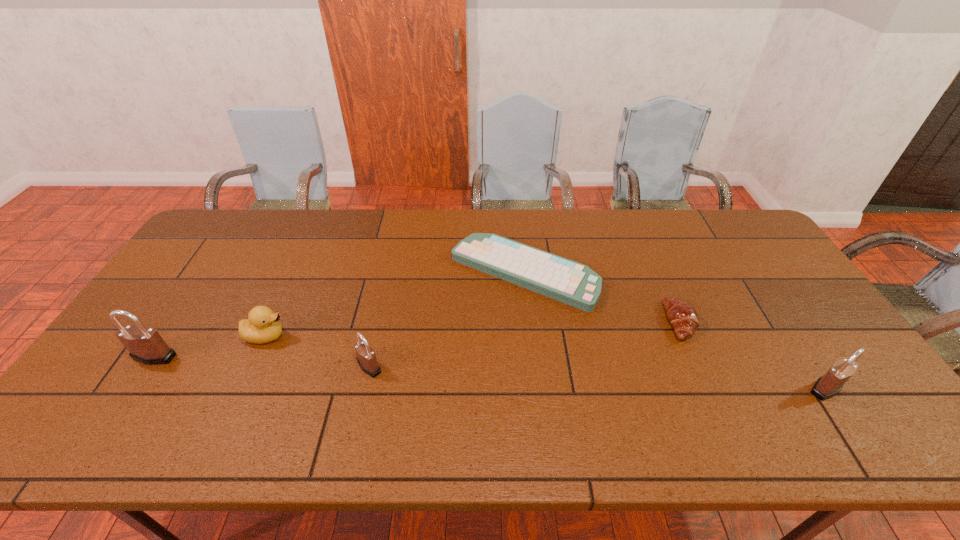
The height and width of the screenshot is (540, 960). What are the coordinates of `the third shortest object` in the screenshot? It's located at (262, 326).

Where is `free spot located on the back of the leftmost padlock`? Image resolution: width=960 pixels, height=540 pixels. free spot located on the back of the leftmost padlock is located at coordinates (216, 264).

You are a GUI agent. You are given a task and a screenshot of the screen. Output one action in this format:
    pyautogui.click(x=<x>, y=<y>)
    Task: Click on the free spot located 0.380m on the back of the second padlock from right to left
    Image resolution: width=960 pixels, height=540 pixels.
    Given the screenshot: What is the action you would take?
    pyautogui.click(x=393, y=261)

Locate an element on the screen. vacant area located on the left of the rightmost padlock is located at coordinates (713, 388).

The height and width of the screenshot is (540, 960). Find the location of `vacant area located 0.090m on the front of the computer keyboard`. vacant area located 0.090m on the front of the computer keyboard is located at coordinates (531, 336).

I want to click on free location located 0.120m on the right of the fifth object from left to right, so click(x=737, y=321).

What are the coordinates of `free spot located 0.260m on the face of the fourth tallest object` in the screenshot? It's located at (383, 336).

Locate an element on the screen. object positioned at the far edge is located at coordinates (567, 281).

Find the location of a particular element. The height and width of the screenshot is (540, 960). object at the left edge is located at coordinates (145, 344).

At what (x,y) coordinates should I click in order to perform the action: click on object located in the right edge section of the desktop. Please return your answer as a coordinate pair (x, y). This screenshot has height=540, width=960. Looking at the image, I should click on (829, 385).